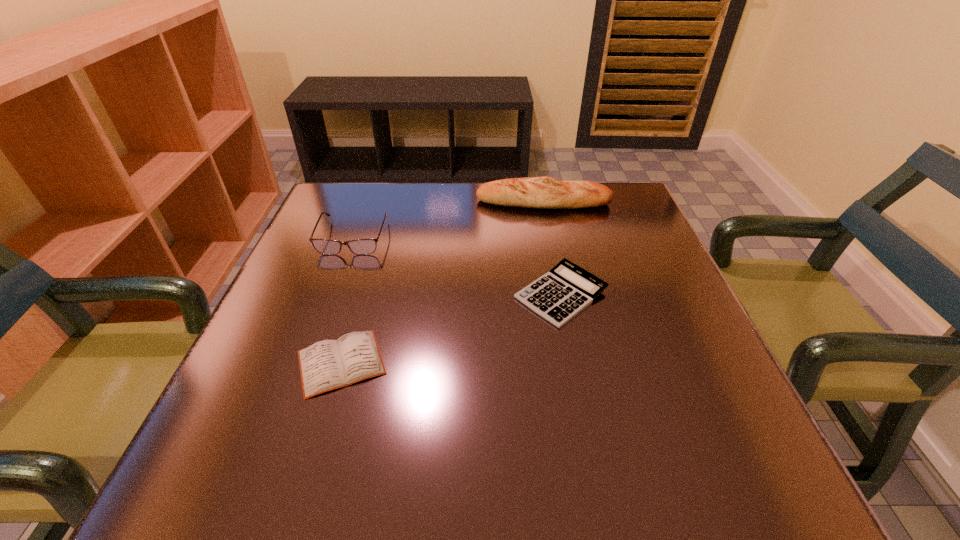
This screenshot has height=540, width=960. Find the location of `free space between the diary and the calculator`. free space between the diary and the calculator is located at coordinates (451, 328).

The image size is (960, 540). Find the location of `vacant area between the second shortest object and the third shortest object`. vacant area between the second shortest object and the third shortest object is located at coordinates (457, 266).

Where is `empty space between the calculator and the second farthest object`? The height and width of the screenshot is (540, 960). empty space between the calculator and the second farthest object is located at coordinates (457, 266).

Where is `free space between the shortest object and the calculator`? free space between the shortest object and the calculator is located at coordinates (451, 328).

In order to click on empty space between the shortest object and the farthest object in this screenshot , I will do `click(443, 282)`.

The width and height of the screenshot is (960, 540). In order to click on free space that is in between the shortest object and the tallest object in this screenshot , I will do `click(443, 282)`.

The width and height of the screenshot is (960, 540). In order to click on vacant space that is in between the baguet and the third nearest object in this screenshot , I will do 448,219.

I want to click on object that is the nearest to the tallest object, so click(x=560, y=294).

Identify the location of object that stands as the closest to the nearest object. The height and width of the screenshot is (540, 960). 323,246.

In order to click on vacant space that satisfies the following two spatial constraints: 1. on the back side of the shortest object; 2. on the right side of the farthest object in this screenshot , I will do [x=389, y=202].